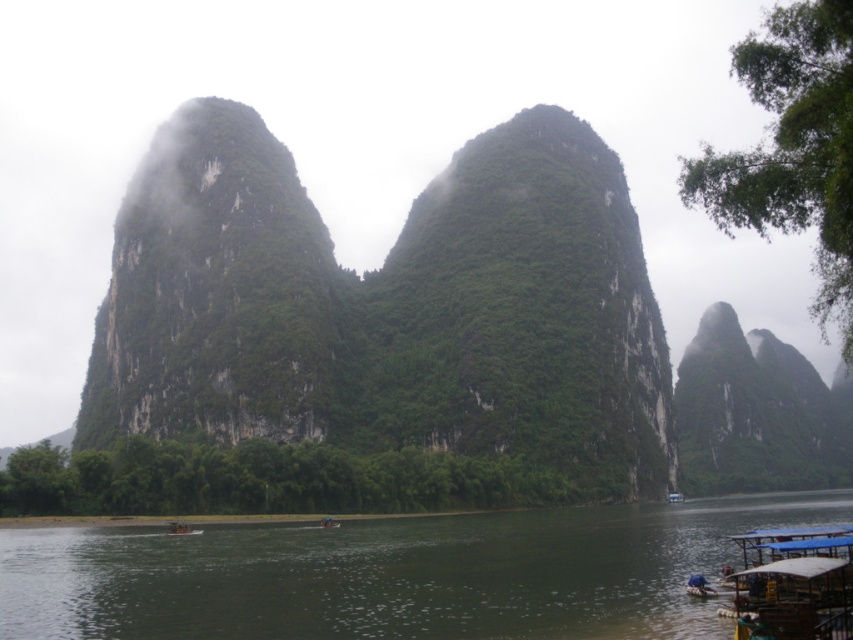
You are standing on the wooden boat at lower center and want to look towards the green textured rock at right. In which direction should you turn your head?

You should turn your head to the right because the green textured rock at right is positioned on the right side of the wooden boat at lower center.

You are planning to take a photo of the green textured rock at right and the wooden boat at lower center from the riverside. Which object should you focus on first if you want to capture both in the same frame without moving your camera?

The green textured rock at right is larger in size than the wooden boat at lower center, so you should focus on the green textured rock at right first to ensure it fits properly in the frame before adjusting for the smaller wooden boat at lower center.